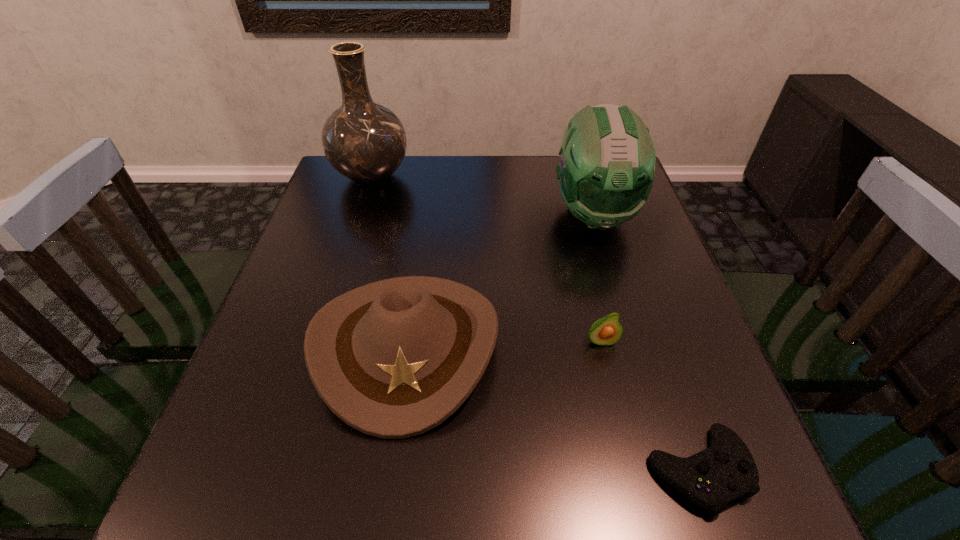
At what (x,y) coordinates should I click in order to perform the action: click on free space between the cowboy hat and the tallest object. Please return your answer as a coordinate pair (x, y). Looking at the image, I should click on (390, 261).

Identify the location of free space between the avocado and the shortest object. tap(649, 406).

Where is `free area in between the tallest object and the third shortest object`? The image size is (960, 540). free area in between the tallest object and the third shortest object is located at coordinates (390, 261).

At what (x,y) coordinates should I click in order to perform the action: click on object that stands as the fourth closest to the football helmet. Please return your answer as a coordinate pair (x, y). Image resolution: width=960 pixels, height=540 pixels. Looking at the image, I should click on (712, 478).

Point out which object is positioned as the fourth nearest to the football helmet. Please provide its 2D coordinates. Your answer should be formatted as a tuple, i.e. [(x, y)], where the tuple contains the x and y coordinates of a point satisfying the conditions above.

[(712, 478)]

The width and height of the screenshot is (960, 540). What are the coordinates of `vacant position in the image that satisfies the following two spatial constraints: 1. on the cut side of the shortest object; 2. on the right side of the avocado` in the screenshot? It's located at (632, 470).

Image resolution: width=960 pixels, height=540 pixels. I want to click on vacant space that satisfies the following two spatial constraints: 1. on the visor of the fourth shortest object; 2. on the left side of the control, so click(x=670, y=470).

In order to click on free space that satisfies the following two spatial constraints: 1. on the visor of the fourth shortest object; 2. on the left side of the control in this screenshot , I will do `click(670, 470)`.

Where is `free space that satisfies the following two spatial constraints: 1. on the cut side of the control; 2. on the left side of the second shortest object`? free space that satisfies the following two spatial constraints: 1. on the cut side of the control; 2. on the left side of the second shortest object is located at coordinates (632, 470).

Image resolution: width=960 pixels, height=540 pixels. Identify the location of vacant region that satisfies the following two spatial constraints: 1. on the cut side of the shortest object; 2. on the right side of the avocado. (632, 470).